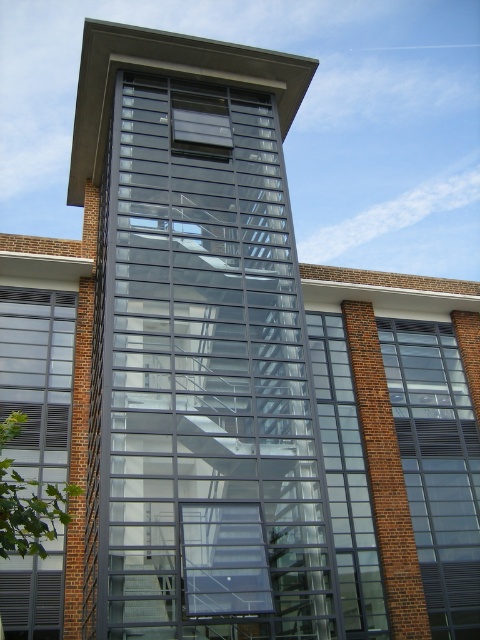
Find the location of a particular element. transparent glass tower at center is located at coordinates (208, 358).

Which is more to the left, transparent glass tower at center or transparent glass window at right?

transparent glass tower at center is more to the left.

Locate an element on the screen. transparent glass tower at center is located at coordinates (208, 358).

Find the location of `transparent glass tower at center`. transparent glass tower at center is located at coordinates (208, 358).

Does transparent glass window at right have a greater width compared to clear glass window at left?

Yes.

Which is in front, point (456, 483) or point (27, 426)?

Point (27, 426) is more forward.

Where is `transparent glass window at right`? Image resolution: width=480 pixels, height=640 pixels. transparent glass window at right is located at coordinates (436, 467).

Does transparent glass tower at center have a lesser height compared to clear glass window at left?

No.

Between transparent glass tower at center and clear glass window at left, which one appears on the left side from the viewer's perspective?

Positioned to the left is clear glass window at left.

Is point (196, 356) farther from viewer compared to point (17, 300)?

That is False.

Locate an element on the screen. This screenshot has width=480, height=640. transparent glass tower at center is located at coordinates (208, 358).